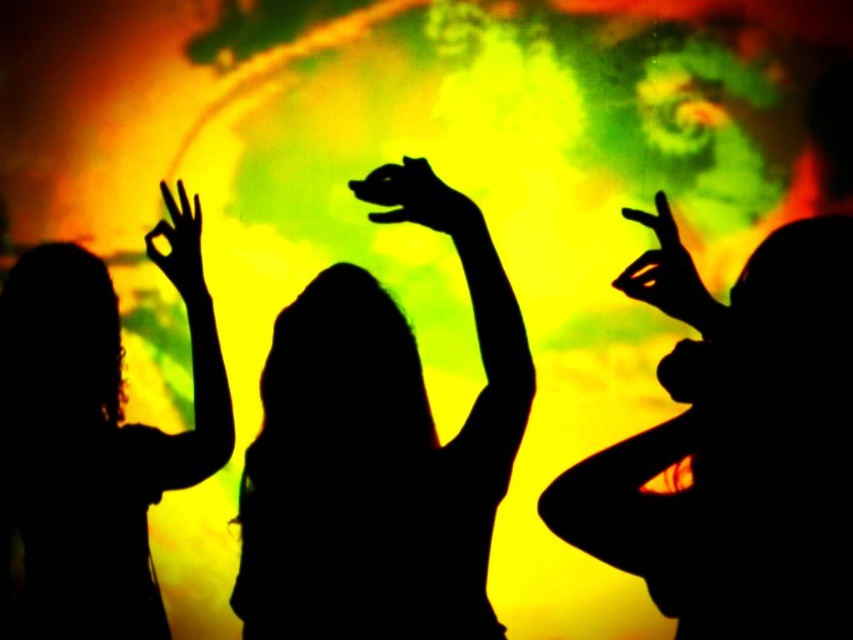
Does black matte hand at upper right have a lesser width compared to black matte hand at upper left?

Indeed, black matte hand at upper right has a lesser width compared to black matte hand at upper left.

Which is below, black matte hand at upper right or black matte hand at upper left?

black matte hand at upper right is lower down.

Is point (647, 289) behind point (166, 189)?

No, it is not.

You are a GUI agent. You are given a task and a screenshot of the screen. Output one action in this format:
    pyautogui.click(x=<x>, y=<y>)
    Task: Click on the black matte hand at upper right
    The width and height of the screenshot is (853, 640).
    Given the screenshot: What is the action you would take?
    pyautogui.click(x=668, y=273)

Is point (299, 442) positioned in front of point (202, 300)?

Yes, point (299, 442) is closer to viewer.

Does black silhouette at center have a greater width compared to black matte hand at upper left?

Yes, black silhouette at center is wider than black matte hand at upper left.

This screenshot has height=640, width=853. I want to click on black silhouette at center, so pos(379,449).

Which is in front, point (120, 634) or point (393, 164)?

Point (393, 164) is more forward.

Consider the image. Who is positioned more to the left, black silhouette at left or black matte hand at center?

black silhouette at left is more to the left.

Is point (65, 444) closer to camera compared to point (451, 200)?

That is False.

This screenshot has height=640, width=853. What are the coordinates of `black silhouette at left` in the screenshot? It's located at (97, 435).